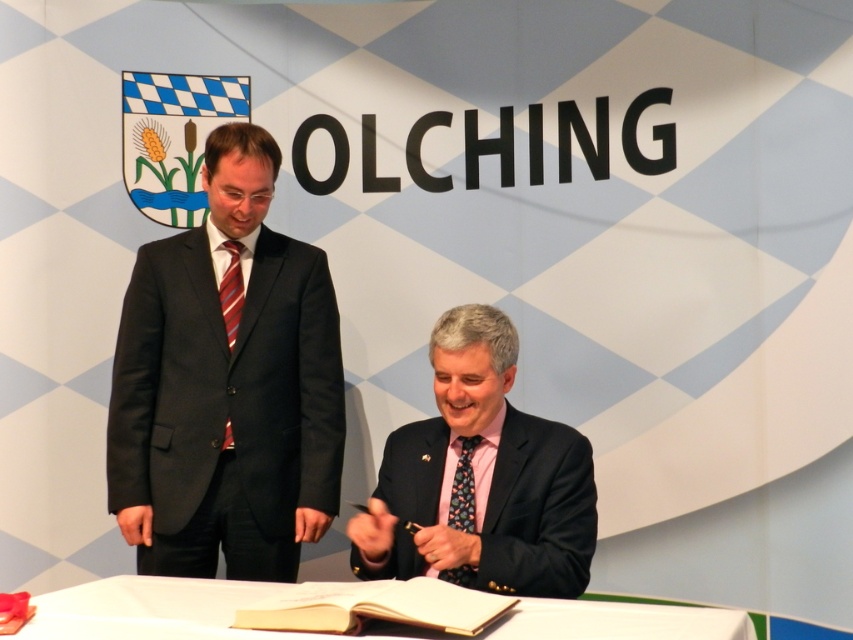
How distant is matte black suit at left from floral silk tie at lower center?

matte black suit at left is 31.49 inches away from floral silk tie at lower center.

Measure the distance between point (231, 515) and camera.

Point (231, 515) is 9.28 feet away from camera.

Does point (196, 253) come farther from viewer compared to point (466, 570)?

Yes, point (196, 253) is farther from viewer.

Locate an element on the screen. This screenshot has height=640, width=853. matte black suit at left is located at coordinates (227, 385).

Can you confirm if pink silk tie at center is positioned to the left of white paper at lower center?

In fact, pink silk tie at center is to the right of white paper at lower center.

Where is `pink silk tie at center`? pink silk tie at center is located at coordinates (480, 477).

In order to click on pink silk tie at center in this screenshot , I will do `click(480, 477)`.

Between white paper at lower center and floral silk tie at lower center, which one is positioned higher?

floral silk tie at lower center is higher up.

At what (x,y) coordinates should I click in order to perform the action: click on white paper at lower center. Please return your answer as a coordinate pair (x, y). This screenshot has width=853, height=640. Looking at the image, I should click on (152, 609).